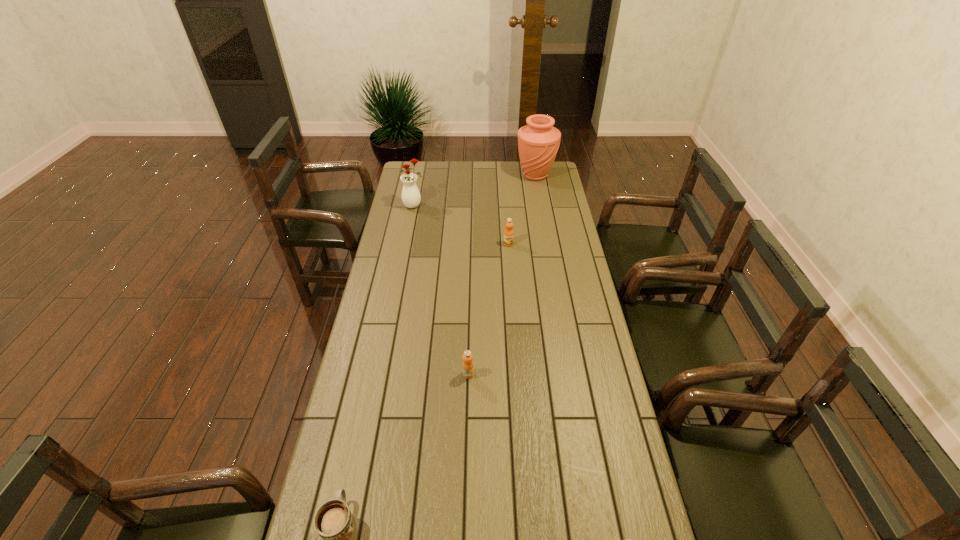
Find the location of `the taller vase`. the taller vase is located at coordinates (538, 142).

Image resolution: width=960 pixels, height=540 pixels. I want to click on the tallest object, so click(538, 142).

Locate an element on the screen. The width and height of the screenshot is (960, 540). the left vase is located at coordinates (411, 197).

The image size is (960, 540). What are the coordinates of `the fifth shortest object` in the screenshot? It's located at (411, 197).

You are a GUI agent. You are given a task and a screenshot of the screen. Output one action in this format:
    pyautogui.click(x=<x>, y=<y>)
    Task: Click on the second orange juice from right to left
    The image size is (960, 540).
    Given the screenshot: What is the action you would take?
    pyautogui.click(x=508, y=233)

The image size is (960, 540). I want to click on the farthest orange juice, so click(508, 233).

This screenshot has height=540, width=960. I want to click on the fourth object from right to left, so click(468, 367).

Locate an element on the screen. The width and height of the screenshot is (960, 540). the leftmost orange juice is located at coordinates (468, 367).

Where is `free space located on the front of the farther vase`? This screenshot has height=540, width=960. free space located on the front of the farther vase is located at coordinates coord(542,215).

This screenshot has height=540, width=960. Identify the location of vacant space located on the right of the left vase. (440, 206).